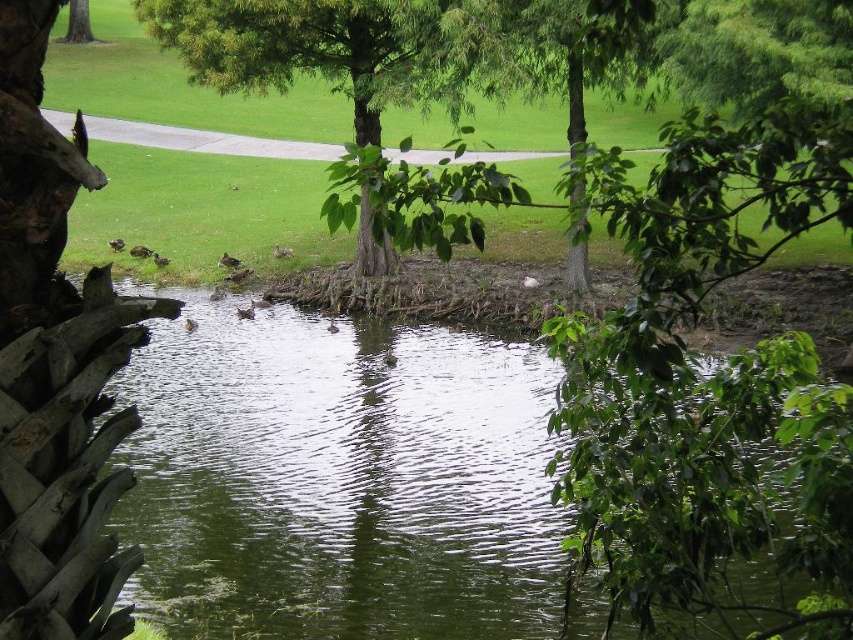
Which is in front, point (117, 451) or point (300, 19)?

Point (117, 451) is more forward.

Who is more distant from viewer, (x=235, y=579) or (x=300, y=60)?

Positioned behind is point (x=300, y=60).

The height and width of the screenshot is (640, 853). In order to click on green liquid water at center in this screenshot , I will do `click(338, 477)`.

Is green liquid water at center to the right of green leafy tree at upper left from the viewer's perspective?

Indeed, green liquid water at center is positioned on the right side of green leafy tree at upper left.

Can you confirm if green liquid water at center is positioned below green leafy tree at upper left?

Correct, green liquid water at center is located below green leafy tree at upper left.

Is point (415, 454) positioned before point (67, 38)?

Yes.

Locate an element on the screen. green liquid water at center is located at coordinates (338, 477).

Does point (427, 384) lie behind point (373, 273)?

No.

Is point (178, 547) less distant than point (357, 92)?

Yes, it is.

Between point (349, 593) and point (386, 260), which one is positioned in front?

Point (349, 593)

The width and height of the screenshot is (853, 640). In order to click on green liquid water at center in this screenshot , I will do `click(338, 477)`.